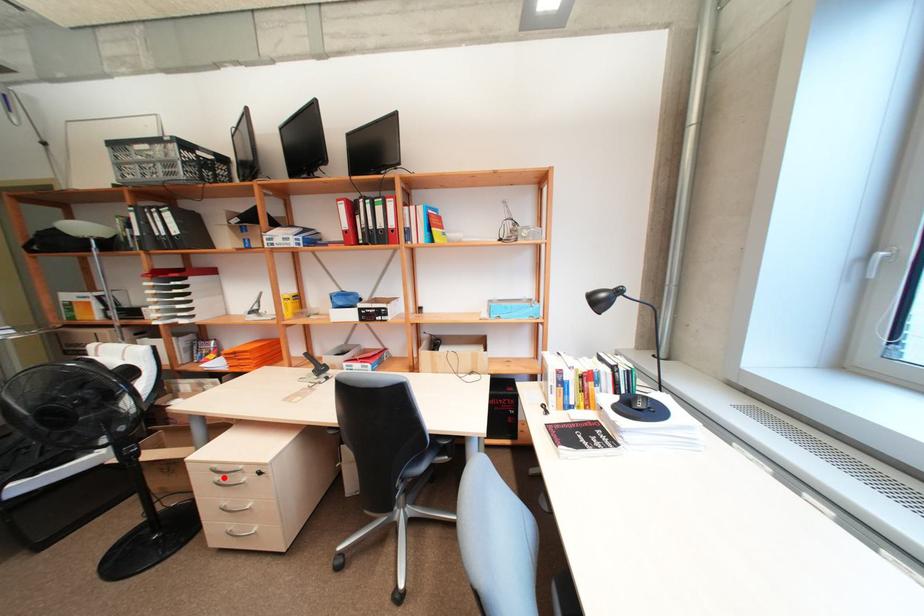
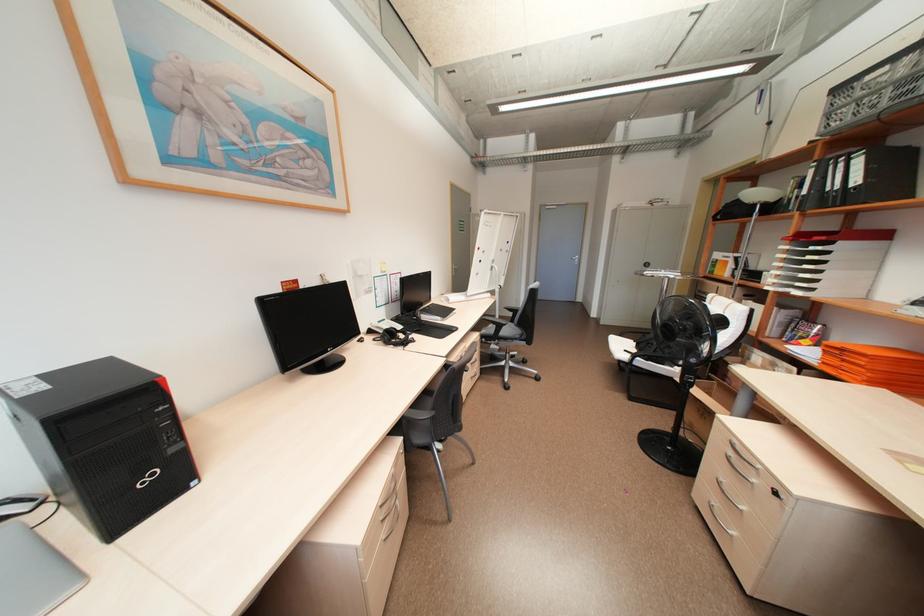
Locate, in the second image, the point that corresponds to the highlighted location in the first image.

(736, 453)